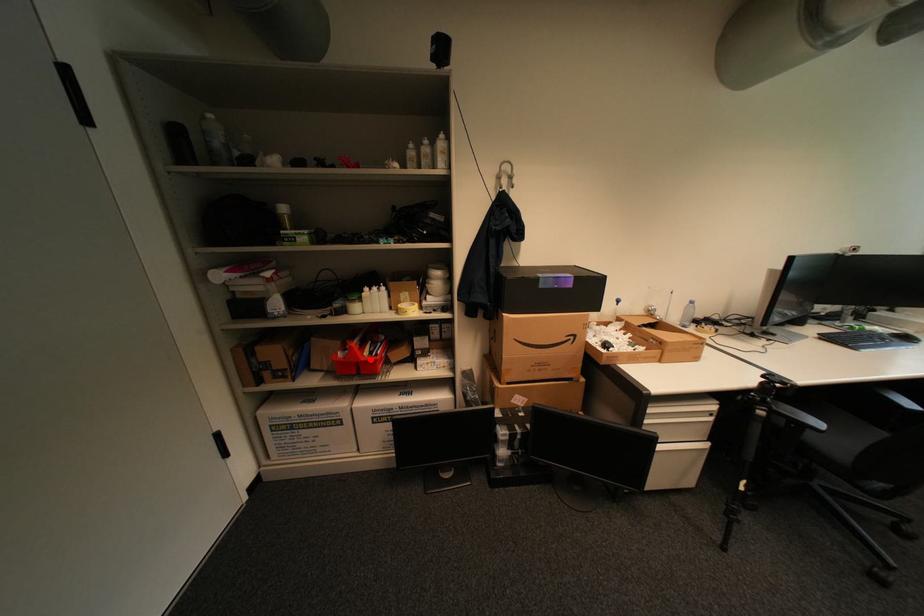
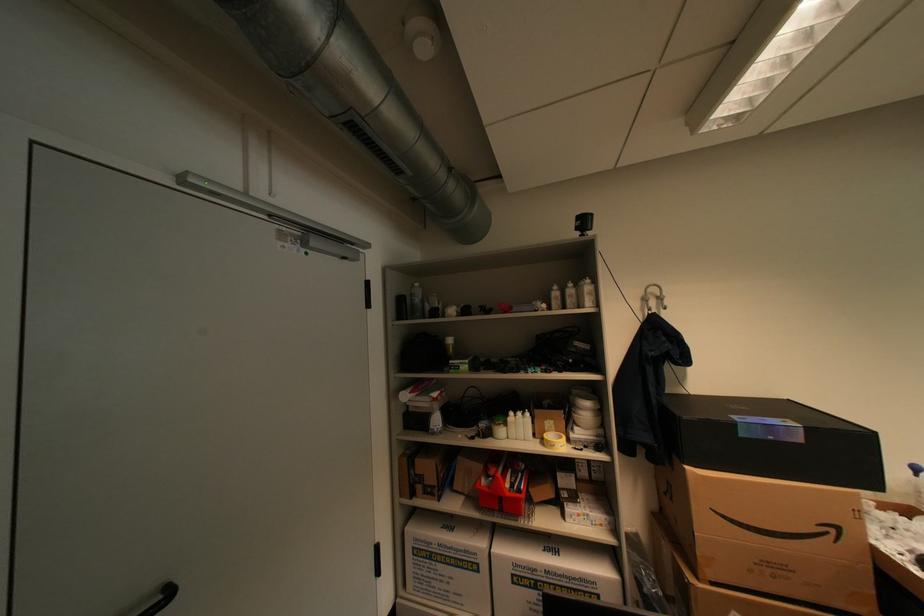
Question: I am providing you with two images of the same scene from different viewpoints. Image1 has a red point marked. In image2, the corresponding 3D location appears at what relative position? Reply with the corresponding letter.

Choices:
 (A) Closer
 (B) Farther

Answer: (B)